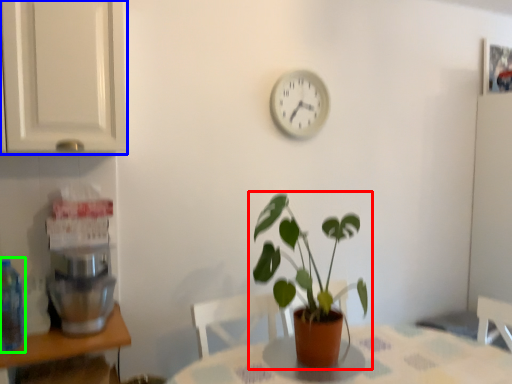
Question: Based on their relative distances, which object is nearer to houseplant (highlighted by a red box)? Choose from cabinetry (highlighted by a blue box) and bottle (highlighted by a green box).

Choices:
 (A) cabinetry
 (B) bottle

Answer: (A)